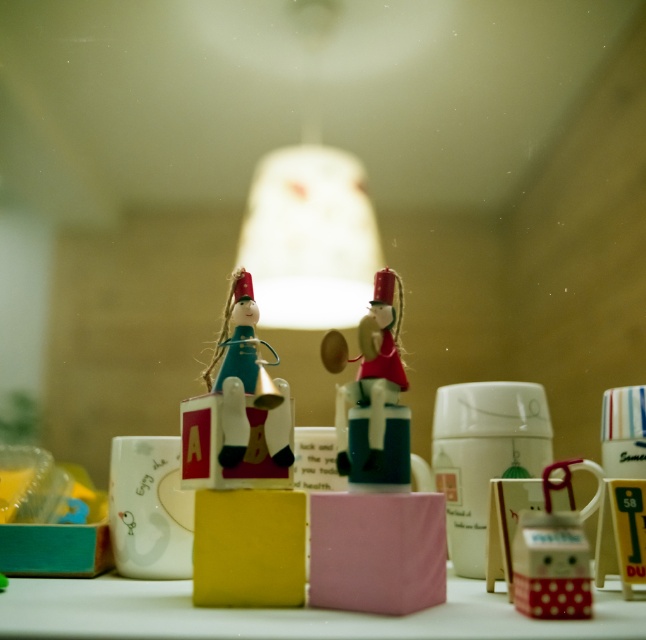
You are looking at the arrangement of two points on the table where the figurines are placed. Which point is nearer to you, point (224, 422) or point (379, 316)?

Point (224, 422) is closer to the viewer than point (379, 316).

You are trying to place a new small vase on the table in the image. Considering the wooden figure at center and the white matte table at center, will the vase fit between them without being blocked by the figure?

The wooden figure at center is much taller than the white matte table at center, so placing the vase between them might be challenging as the figure could block the view or access to the table surface.